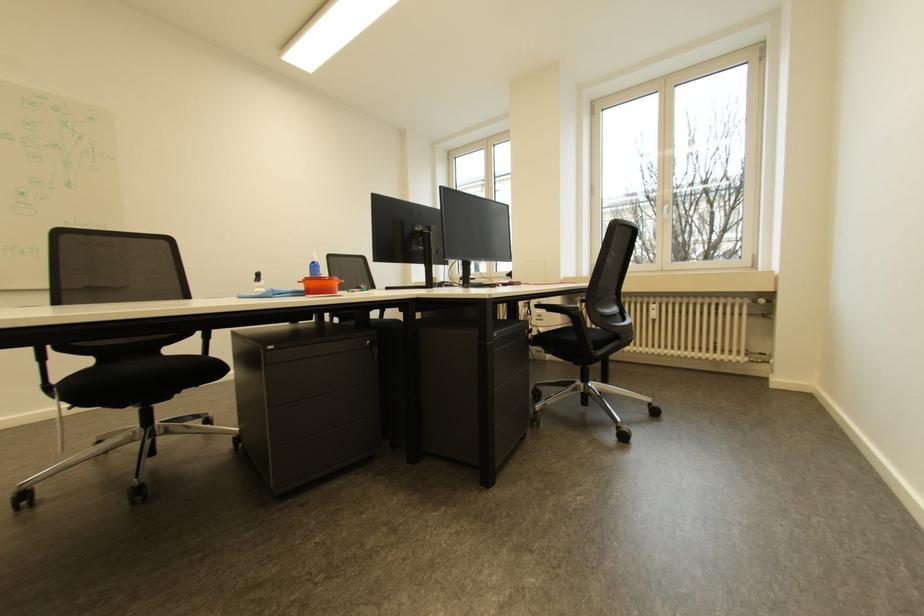
Image resolution: width=924 pixels, height=616 pixels. What are the coordinates of `drawer handle` in the screenshot? It's located at (317, 349).